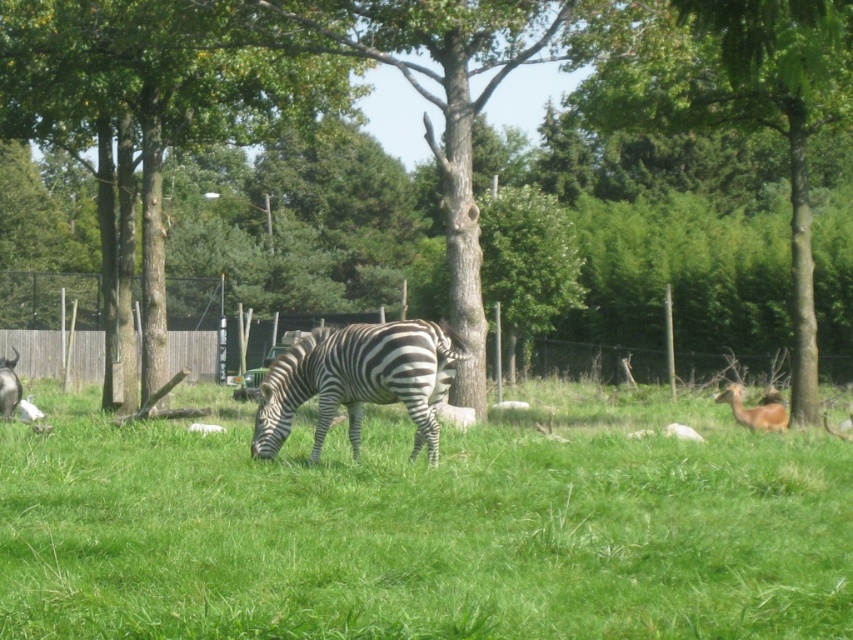
You are a photographer trying to capture a clear shot of the black and white striped zebra at center. Since you are standing on the green grassy at center, will the zebra be visible above the grass?

The green grassy at center is shorter than the black and white striped zebra at center, so yes, the zebra will be visible above the grass.

You are standing at the point labeled as point (x=424, y=528) in the image. Looking around, you see the green grassy area at center and the zebra grazing. Which direction should you walk to reach the zebra?

The point labeled point (x=424, y=528) marks the green grassy area at center, so you are already in the center where the green grassy area is located. The zebra is grazing in the foreground, which is likely in front of your current position. Therefore, you should walk forward from point (x=424, y=528) towards the foreground to reach the zebra.

Consider the image. You are a park ranger planning to plant a new tree in the middle of the zoo area. You observe the brown textured tree at center and the green textured tree at center. Which tree should you avoid planting over to ensure proper growth?

You should avoid planting over the green textured tree at center because the brown textured tree at center is already positioned over it, indicating it may be blocking sunlight or nutrients necessary for the new tree to grow properly.